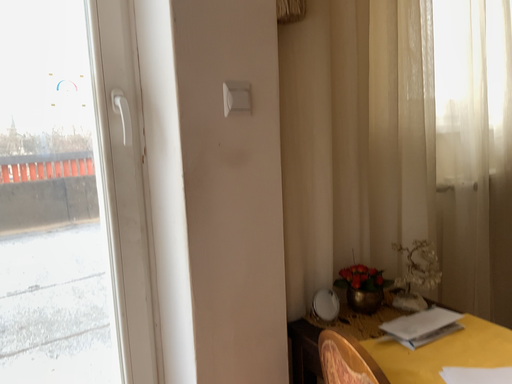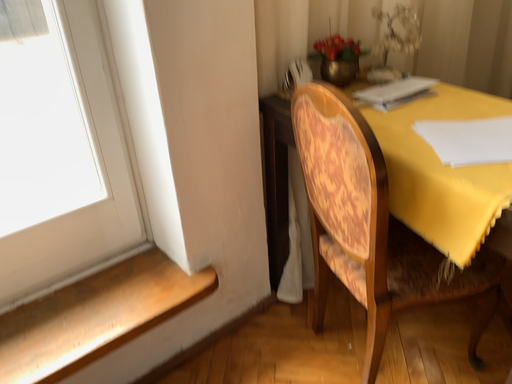
Question: How did the camera likely rotate when shooting the video?

Choices:
 (A) rotated downward
 (B) rotated upward

Answer: (A)